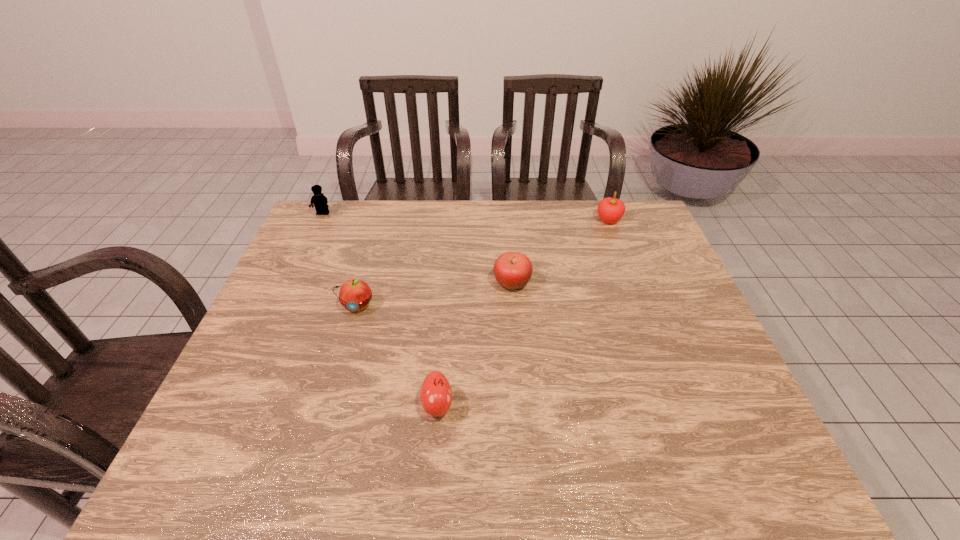
The height and width of the screenshot is (540, 960). I want to click on free space that is in between the farthest apple and the second object from left to right, so click(x=483, y=263).

This screenshot has width=960, height=540. Find the location of `vacant area between the leftmost object and the third apple from left to right`. vacant area between the leftmost object and the third apple from left to right is located at coordinates (418, 248).

This screenshot has height=540, width=960. I want to click on free space between the leftmost object and the fourth object from left to right, so click(418, 248).

What are the coordinates of `free area in between the leftmost apple and the rightmost object` in the screenshot? It's located at (483, 263).

You are a GUI agent. You are given a task and a screenshot of the screen. Output one action in this format:
    pyautogui.click(x=<x>, y=<y>)
    Task: Click on the fourth closest object to the third object from right to left
    The height and width of the screenshot is (540, 960).
    Given the screenshot: What is the action you would take?
    pyautogui.click(x=320, y=202)

Locate which object ranks third in proximity to the third apple from left to right. Please provide its 2D coordinates. Your answer should be formatted as a tuple, i.e. [(x, y)], where the tuple contains the x and y coordinates of a point satisfying the conditions above.

[(355, 294)]

Select which apple appears as the second closest to the second apple from left to right. Please provide its 2D coordinates. Your answer should be formatted as a tuple, i.e. [(x, y)], where the tuple contains the x and y coordinates of a point satisfying the conditions above.

[(512, 270)]

Identify which apple is located as the second nearest to the second apple from left to right. Please provide its 2D coordinates. Your answer should be formatted as a tuple, i.e. [(x, y)], where the tuple contains the x and y coordinates of a point satisfying the conditions above.

[(512, 270)]

Locate an element on the screen. The image size is (960, 540). vacant point that satisfies the following two spatial constraints: 1. on the front side of the second apple from left to right; 2. on the left side of the leftmost apple is located at coordinates (328, 406).

Locate an element on the screen. This screenshot has width=960, height=540. free region that satisfies the following two spatial constraints: 1. on the front-facing side of the Lego; 2. on the right side of the rightmost object is located at coordinates (320, 220).